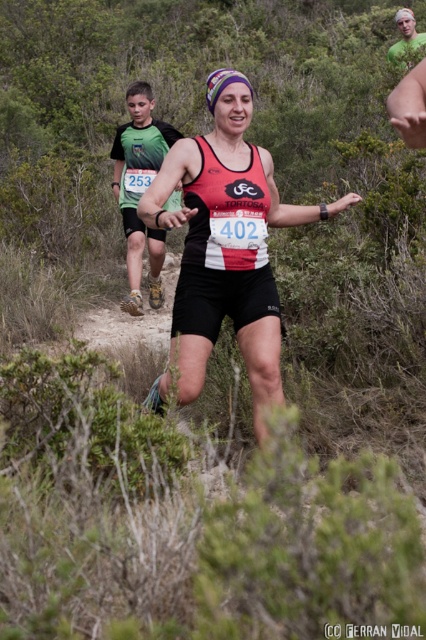
Based on the photo, you are a photographer at the trail race and want to capture a photo of both runners. The first runner is at point (x=206, y=362) and the second runner is at point (x=124, y=176). Which runner is closer to your camera position?

Point (x=206, y=362) is closer to the viewer than point (x=124, y=176), so the first runner at point (x=206, y=362) is closer to your camera position.

You are a photographer at the trail running event. You want to capture a photo of the runner in the matte black tank top at center and the runner in the green fabric shirt at left. Based on their positions, which runner is closer to the camera?

The matte black tank top at center is closer to the camera because it is in front of the green fabric shirt at left.

You are a photographer trying to capture the runner with the number 402 on her bib. You want to ensure that both the point at coordinates point (210, 241) and point (402, 38) are visible in your shot. Given their positions, which point should you focus on to ensure the runner with the number 402 is in focus?

You should focus on point (210, 241) because it is closer to the viewer than point (402, 38), ensuring the runner with the number 402 is in focus.